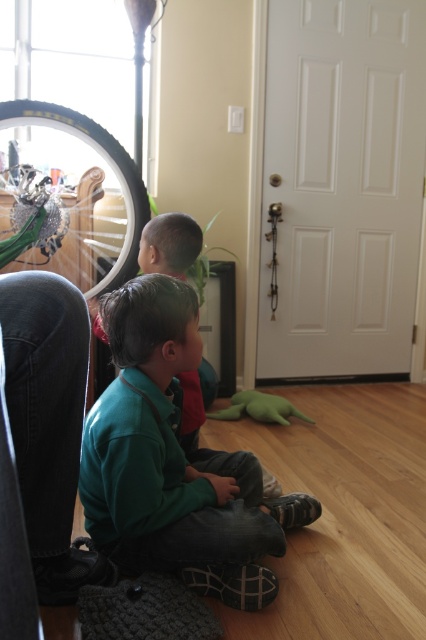
How much distance is there between dark green fabric pants at lower left and green plush toy at lower center?

They are 4.66 feet apart.

From the picture: Can you confirm if dark green fabric pants at lower left is wider than green plush toy at lower center?

No, dark green fabric pants at lower left is not wider than green plush toy at lower center.

In order to click on dark green fabric pants at lower left in this screenshot , I will do `click(48, 424)`.

Where is `dark green fabric pants at lower left`? dark green fabric pants at lower left is located at coordinates (48, 424).

Can you confirm if shiny metallic bicycle wheel at left is positioned to the left of green plush toy at lower center?

Yes, shiny metallic bicycle wheel at left is to the left of green plush toy at lower center.

What do you see at coordinates (68, 196) in the screenshot? I see `shiny metallic bicycle wheel at left` at bounding box center [68, 196].

The height and width of the screenshot is (640, 426). Find the location of `shiny metallic bicycle wheel at left`. shiny metallic bicycle wheel at left is located at coordinates coord(68,196).

Is green soft shirt at lower left bigger than shiny metallic bicycle wheel at left?

No, green soft shirt at lower left is not bigger than shiny metallic bicycle wheel at left.

Is point (143, 486) positioned after point (137, 193)?

No.

Image resolution: width=426 pixels, height=640 pixels. In order to click on green soft shirt at lower left in this screenshot , I will do `click(173, 461)`.